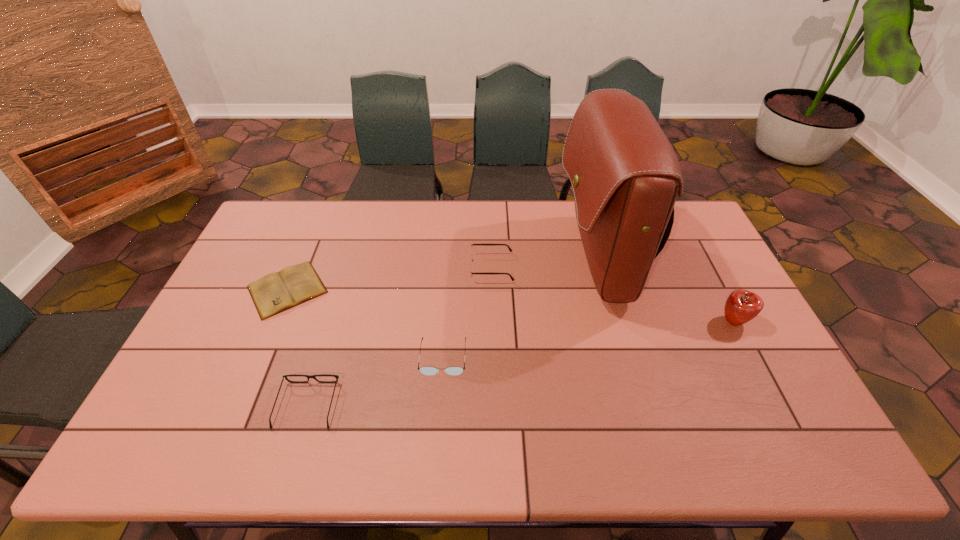
This screenshot has width=960, height=540. I want to click on the fifth object from left to right, so click(x=625, y=175).

Find the location of a particular element. The image size is (960, 540). the tallest object is located at coordinates (625, 175).

In order to click on the fifth shortest object in this screenshot , I will do `click(741, 306)`.

Locate an element on the screen. This screenshot has height=540, width=960. apple is located at coordinates (741, 306).

Locate an element on the screen. the farthest spectacles is located at coordinates (471, 246).

You are a GUI agent. You are given a task and a screenshot of the screen. Output one action in this format:
    pyautogui.click(x=<x>, y=<y>)
    Task: Click on the rightmost spectacles
    This screenshot has width=960, height=540.
    Given the screenshot: What is the action you would take?
    pyautogui.click(x=471, y=246)

The height and width of the screenshot is (540, 960). Identify the location of the second nearest spectacles. (429, 371).

The image size is (960, 540). In order to click on the second spectacles from right to left in this screenshot , I will do `click(429, 371)`.

The height and width of the screenshot is (540, 960). Identify the location of the nearest object. (284, 376).

I want to click on the leftmost spectacles, so click(x=284, y=376).